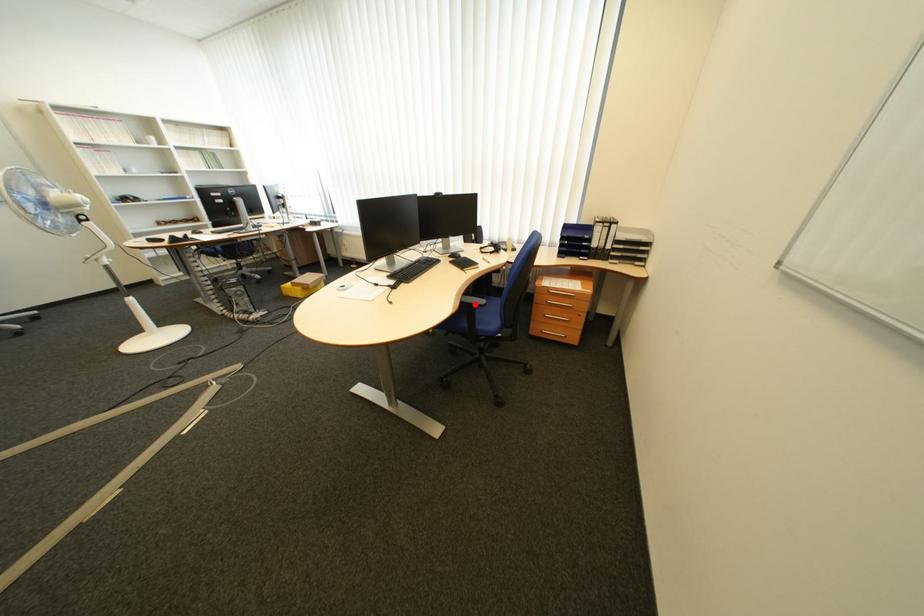
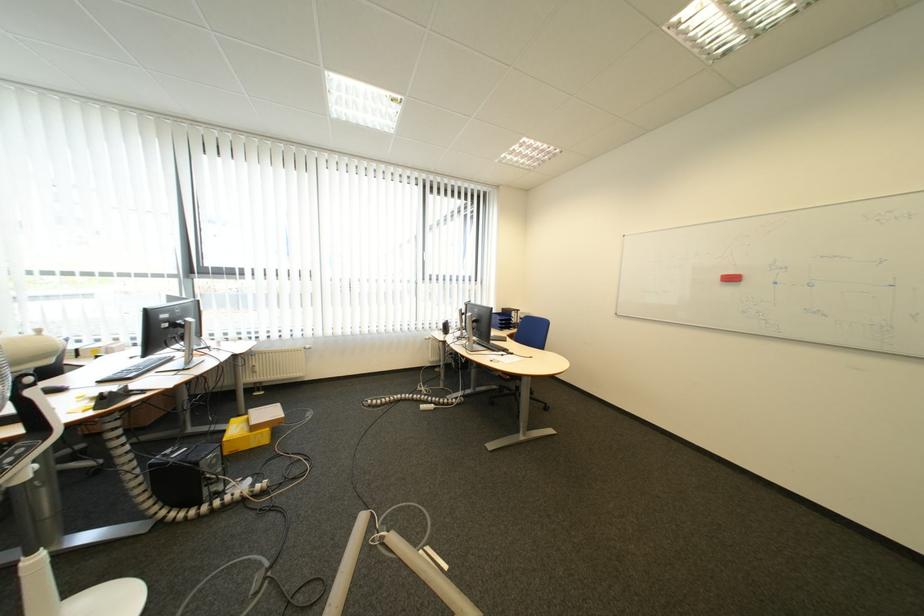
Question: I am providing you with two images of the same scene from different viewpoints. A red point is marked on the first image. Is the red point's position out of view in image 2?

Choices:
 (A) Yes
 (B) No

Answer: (A)